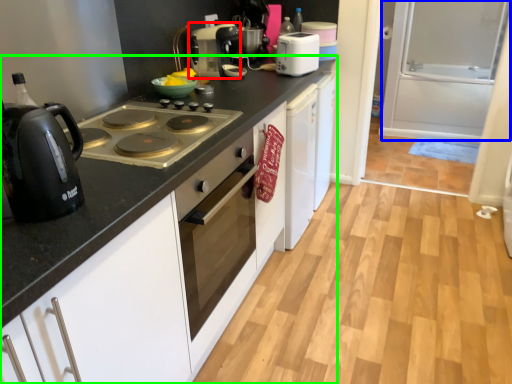
Question: Which is nearer to the kitchen appliance (highlighted by a red box)? screen door (highlighted by a blue box) or countertop (highlighted by a green box).

Choices:
 (A) screen door
 (B) countertop

Answer: (B)